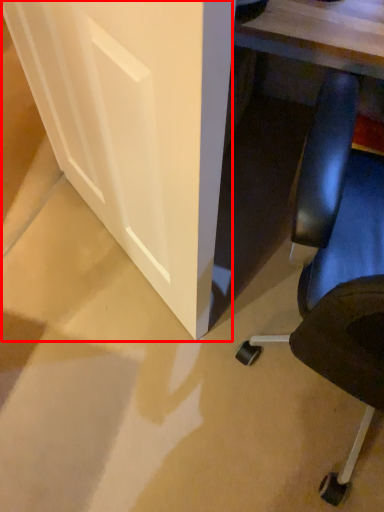
Question: From the image's perspective, where is glass door (annotated by the red box) located in relation to chair in the image?

Choices:
 (A) above
 (B) below

Answer: (A)